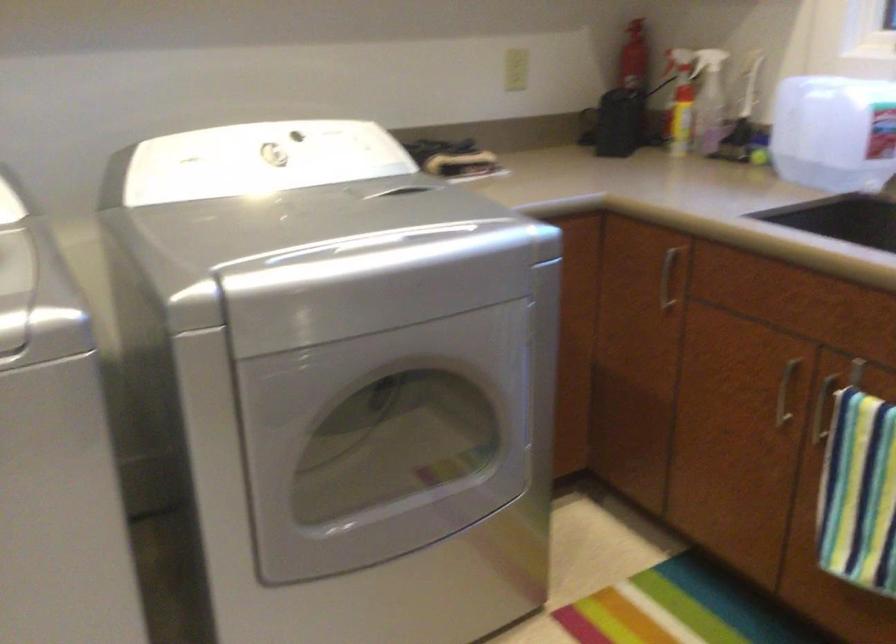
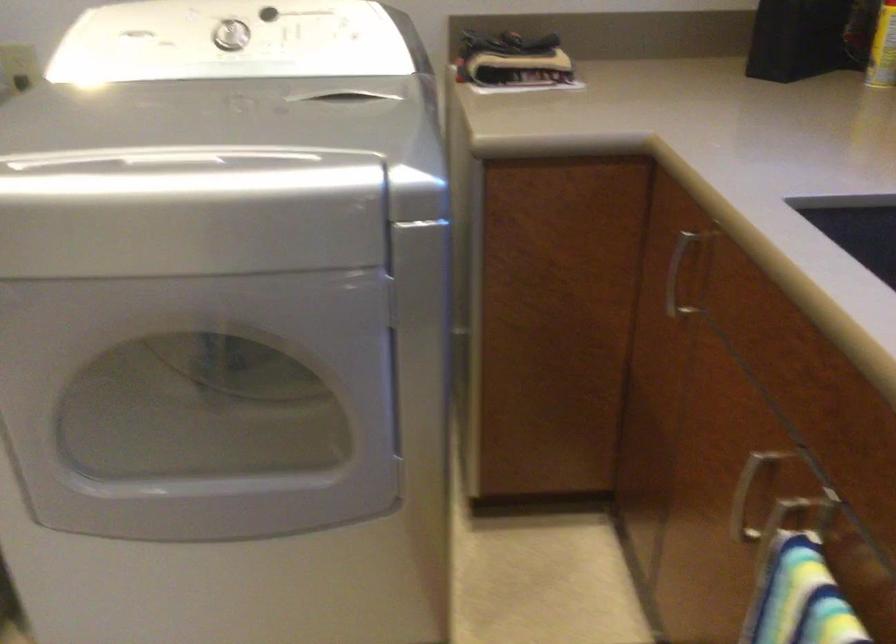
In the second image, find the point that corresponds to the point at 270,156 in the first image.

(229, 35)